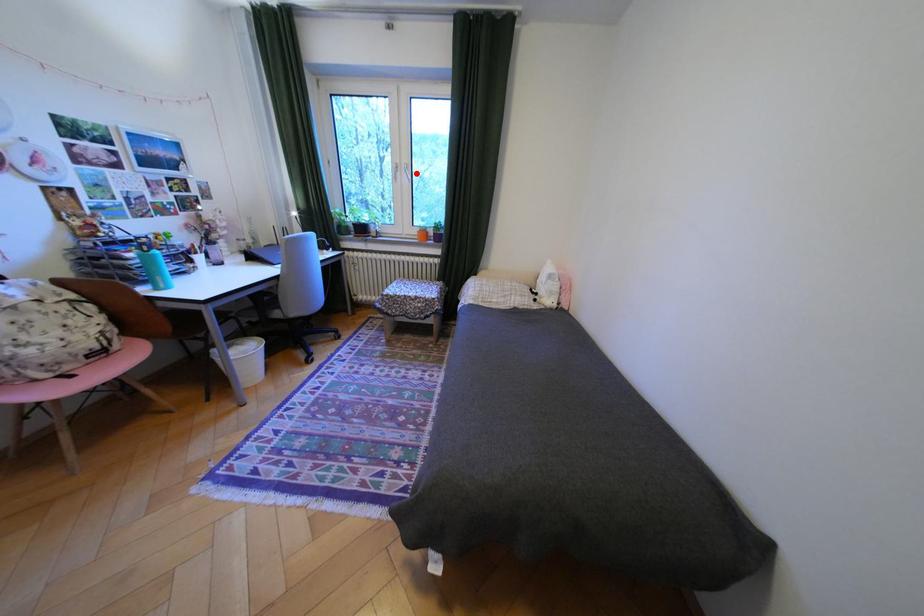
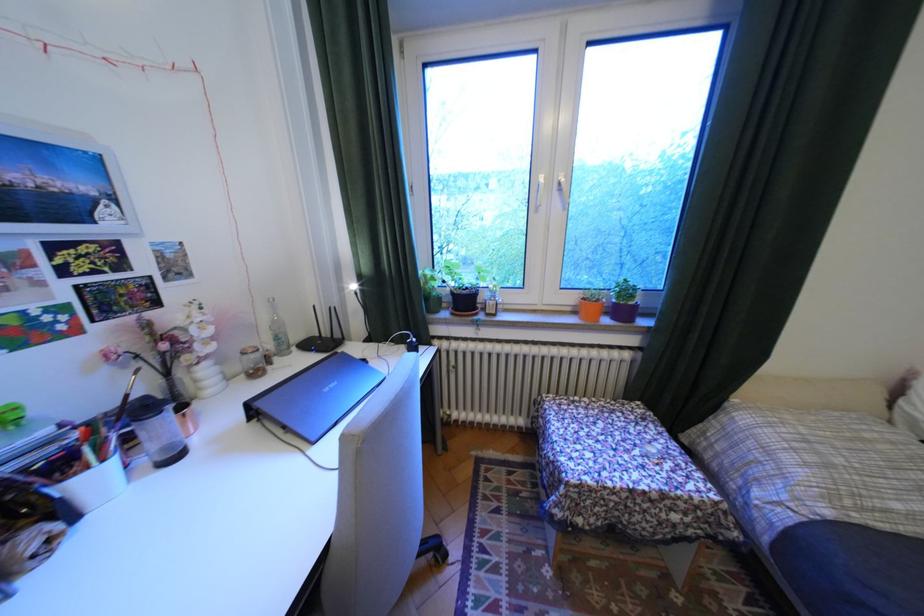
Where in the second image is the point corresponding to the highlighted location from the first image?

(566, 195)